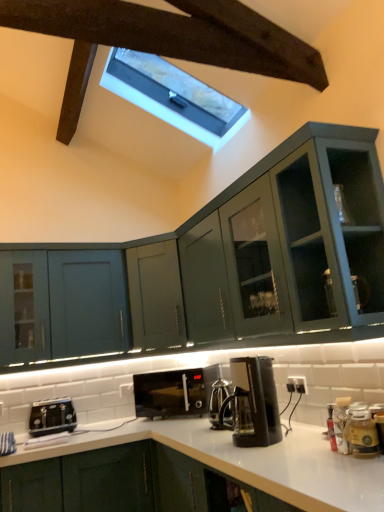
Question: Does matte green cabinet at left, the 2th cabinetry positioned from the bottom, have a greater height compared to translucent glass jar at lower right?

Choices:
 (A) no
 (B) yes

Answer: (B)

Question: Is matte green cabinet at left, the 2th cabinetry positioned from the bottom, outside of translucent glass jar at lower right?

Choices:
 (A) yes
 (B) no

Answer: (A)

Question: Does matte green cabinet at left, which appears as the first cabinetry when viewed from the top, have a larger size compared to translucent glass jar at lower right?

Choices:
 (A) yes
 (B) no

Answer: (A)

Question: From the image's perspective, would you say matte green cabinet at left, which appears as the first cabinetry when viewed from the top, is positioned over translucent glass jar at lower right?

Choices:
 (A) yes
 (B) no

Answer: (A)

Question: Is matte green cabinet at left, the 2th cabinetry positioned from the bottom, to the left of translucent glass jar at lower right from the viewer's perspective?

Choices:
 (A) no
 (B) yes

Answer: (B)

Question: Based on their sizes in the image, would you say black matte toaster at lower left, arranged as the first cabinetry when ordered from the bottom, is bigger or smaller than matte green cabinet at left, the 2th cabinetry positioned from the bottom?

Choices:
 (A) big
 (B) small

Answer: (A)

Question: From a real-world perspective, is black matte toaster at lower left, the second cabinetry from the top, above or below matte green cabinet at left, the 2th cabinetry positioned from the bottom?

Choices:
 (A) above
 (B) below

Answer: (B)

Question: In terms of height, does black matte toaster at lower left, arranged as the first cabinetry when ordered from the bottom, look taller or shorter compared to matte green cabinet at left, the 2th cabinetry positioned from the bottom?

Choices:
 (A) short
 (B) tall

Answer: (A)

Question: From the image's perspective, is black matte toaster at lower left, the second cabinetry from the top, above or below matte green cabinet at left, which appears as the first cabinetry when viewed from the top?

Choices:
 (A) above
 (B) below

Answer: (B)

Question: Is white marble window at upper center in front of or behind translucent glass jar at lower right in the image?

Choices:
 (A) front
 (B) behind

Answer: (B)

Question: Considering the positions of white marble window at upper center and translucent glass jar at lower right in the image, is white marble window at upper center taller or shorter than translucent glass jar at lower right?

Choices:
 (A) tall
 (B) short

Answer: (A)

Question: Is point (160, 97) closer or farther from the camera than point (369, 454)?

Choices:
 (A) farther
 (B) closer

Answer: (A)

Question: In the image, is white marble window at upper center on the left side or the right side of translucent glass jar at lower right?

Choices:
 (A) right
 (B) left

Answer: (B)

Question: Considering the positions of black plastic coffee maker at center and black plastic toaster at lower left in the image, is black plastic coffee maker at center wider or thinner than black plastic toaster at lower left?

Choices:
 (A) thin
 (B) wide

Answer: (A)

Question: Is point (241, 416) closer or farther from the camera than point (31, 435)?

Choices:
 (A) closer
 (B) farther

Answer: (A)